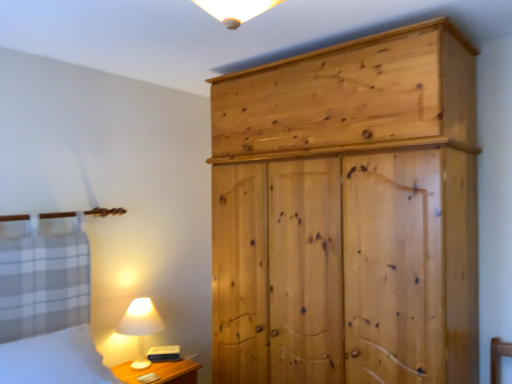
Question: Considering the relative sizes of wooden nightstand at lower left and natural wood wardrobe at right in the image provided, is wooden nightstand at lower left taller than natural wood wardrobe at right?

Choices:
 (A) yes
 (B) no

Answer: (B)

Question: Does wooden nightstand at lower left have a lesser width compared to natural wood wardrobe at right?

Choices:
 (A) no
 (B) yes

Answer: (B)

Question: Is wooden nightstand at lower left positioned beyond the bounds of natural wood wardrobe at right?

Choices:
 (A) no
 (B) yes

Answer: (B)

Question: From a real-world perspective, is wooden nightstand at lower left below natural wood wardrobe at right?

Choices:
 (A) no
 (B) yes

Answer: (B)

Question: Is wooden nightstand at lower left next to natural wood wardrobe at right and touching it?

Choices:
 (A) no
 (B) yes

Answer: (A)

Question: Looking at the image, does white matte table lamp at lower left seem bigger or smaller compared to natural wood wardrobe at right?

Choices:
 (A) small
 (B) big

Answer: (A)

Question: Relative to natural wood wardrobe at right, is white matte table lamp at lower left in front or behind?

Choices:
 (A) behind
 (B) front

Answer: (A)

Question: Is white matte table lamp at lower left taller or shorter than natural wood wardrobe at right?

Choices:
 (A) tall
 (B) short

Answer: (B)

Question: Considering the positions of white matte table lamp at lower left and natural wood wardrobe at right in the image, is white matte table lamp at lower left wider or thinner than natural wood wardrobe at right?

Choices:
 (A) wide
 (B) thin

Answer: (B)

Question: Is natural wood wardrobe at right wider or thinner than white cotton bed at lower left?

Choices:
 (A) wide
 (B) thin

Answer: (A)

Question: From the image's perspective, is natural wood wardrobe at right located above or below white cotton bed at lower left?

Choices:
 (A) above
 (B) below

Answer: (A)

Question: Considering their positions, is natural wood wardrobe at right located in front of or behind white cotton bed at lower left?

Choices:
 (A) behind
 (B) front

Answer: (A)

Question: From their relative heights in the image, would you say natural wood wardrobe at right is taller or shorter than white cotton bed at lower left?

Choices:
 (A) short
 (B) tall

Answer: (B)

Question: From the image's perspective, relative to wooden nightstand at lower left, is natural wood wardrobe at right above or below?

Choices:
 (A) below
 (B) above

Answer: (B)

Question: Considering the positions of natural wood wardrobe at right and wooden nightstand at lower left in the image, is natural wood wardrobe at right wider or thinner than wooden nightstand at lower left?

Choices:
 (A) wide
 (B) thin

Answer: (A)